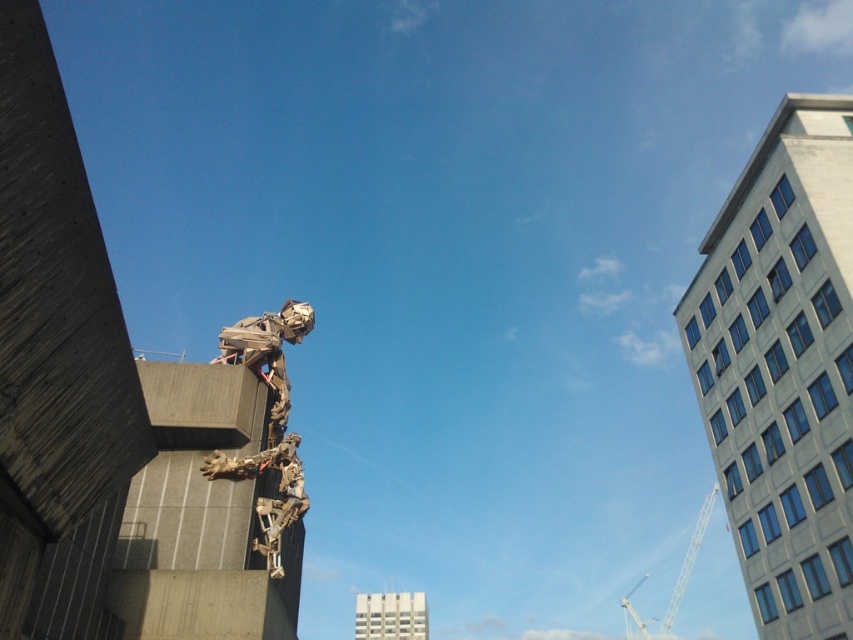
Question: Which of the following is the closest to the observer?

Choices:
 (A) metallic silver crane at upper right
 (B) wooden sculpture at center

Answer: (B)

Question: Does wooden sculpture at center have a larger size compared to metallic silver crane at upper right?

Choices:
 (A) no
 (B) yes

Answer: (A)

Question: Can you confirm if wooden sculpture at center is thinner than metallic silver crane at upper right?

Choices:
 (A) yes
 (B) no

Answer: (A)

Question: Which point appears farthest from the camera in this image?

Choices:
 (A) (271, 467)
 (B) (668, 627)

Answer: (B)

Question: Is wooden sculpture at center positioned in front of metallic silver crane at upper right?

Choices:
 (A) yes
 (B) no

Answer: (A)

Question: Which point is farther to the camera?

Choices:
 (A) (277, 442)
 (B) (668, 609)

Answer: (B)